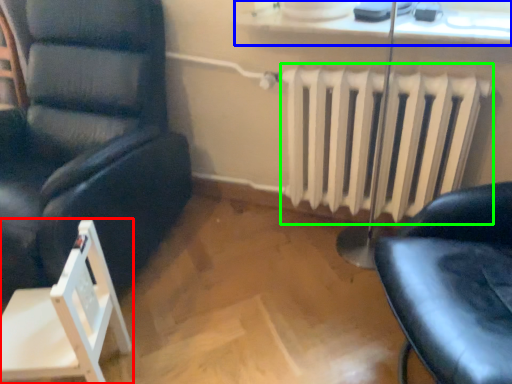
Question: Which is nearer to the chair (highlighted by a red box)? window sill (highlighted by a blue box) or radiator (highlighted by a green box).

Choices:
 (A) window sill
 (B) radiator

Answer: (B)